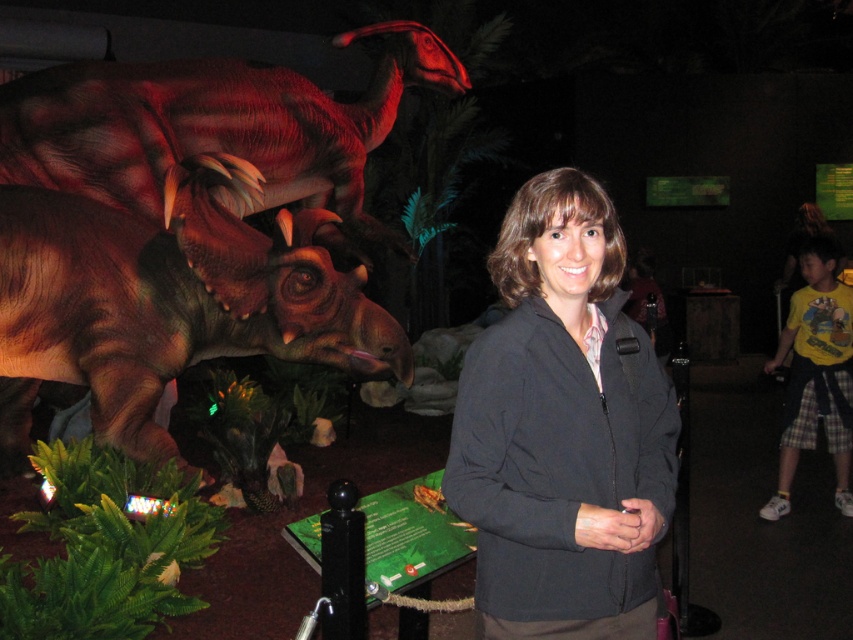
Does black fabric jacket at center appear under shiny brown dinosaur at upper left?

Correct, black fabric jacket at center is located below shiny brown dinosaur at upper left.

Measure the distance from black fabric jacket at center to shiny brown dinosaur at upper left.

black fabric jacket at center and shiny brown dinosaur at upper left are 11.68 feet apart from each other.

Identify the location of black fabric jacket at center. The image size is (853, 640). (561, 429).

Can you confirm if brown matte/dull triceratops at left is wider than shiny brown dinosaur at upper left?

No.

This screenshot has width=853, height=640. What are the coordinates of `brown matte/dull triceratops at left` in the screenshot? It's located at (167, 300).

What do you see at coordinates (167, 300) in the screenshot? The height and width of the screenshot is (640, 853). I see `brown matte/dull triceratops at left` at bounding box center [167, 300].

Locate an element on the screen. brown matte/dull triceratops at left is located at coordinates (167, 300).

Can you confirm if shiny brown dinosaur at upper left is positioned below yellow printed t-shirt at right?

No, shiny brown dinosaur at upper left is not below yellow printed t-shirt at right.

Which of these two, shiny brown dinosaur at upper left or yellow printed t-shirt at right, stands taller?

shiny brown dinosaur at upper left

Locate an element on the screen. shiny brown dinosaur at upper left is located at coordinates (215, 124).